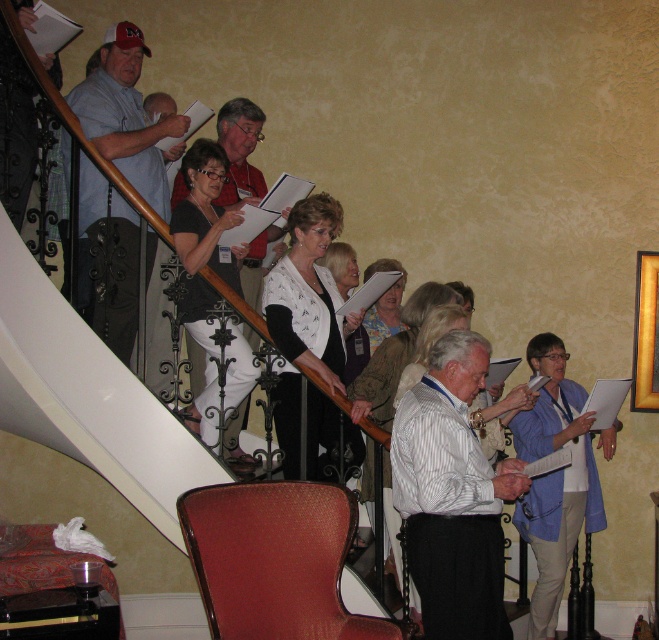
Between matte black blazer at center and white textured sweater at center, which one is positioned higher?

Positioned higher is white textured sweater at center.

Can you confirm if matte black blazer at center is positioned to the left of white textured sweater at center?

In fact, matte black blazer at center is to the right of white textured sweater at center.

Between point (387, 515) and point (355, 332), which one is positioned behind?

The point (355, 332) is behind.

Find the location of `matte black blazer at center`. matte black blazer at center is located at coordinates (395, 355).

Who is shorter, white striped shirt at center or white textured sweater at center?

Standing shorter between the two is white textured sweater at center.

Does white striped shirt at center have a smaller size compared to white textured sweater at center?

No.

Where is `white striped shirt at center`? The width and height of the screenshot is (659, 640). white striped shirt at center is located at coordinates (451, 493).

Is blue fabric shirt at lower right thinner than white textured sweater at center?

No.

Does point (546, 596) come in front of point (362, 332)?

Yes, point (546, 596) is in front of point (362, 332).

Identify the location of blue fabric shirt at lower right. The width and height of the screenshot is (659, 640). (554, 477).

Where is `blue fabric shirt at lower right`? This screenshot has height=640, width=659. blue fabric shirt at lower right is located at coordinates (554, 477).